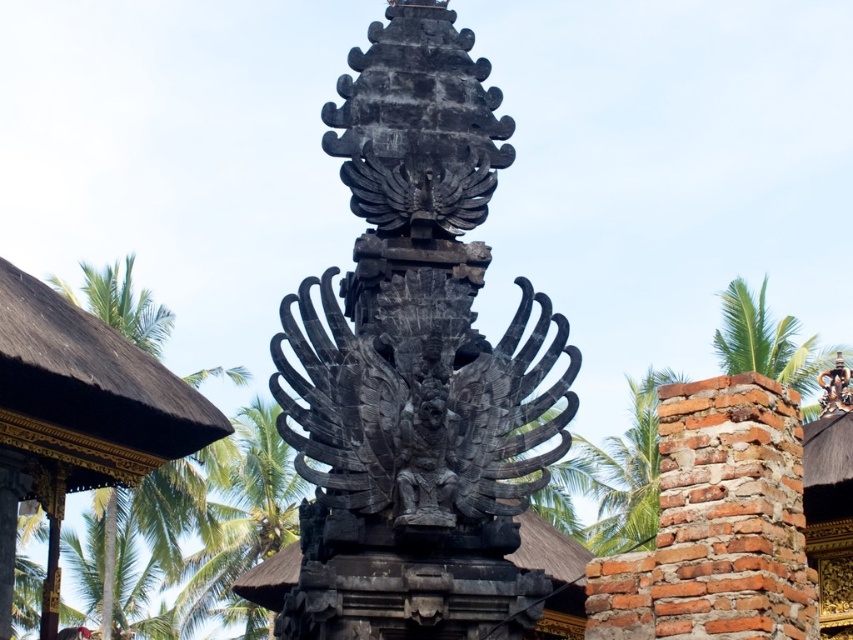
Question: Which object is positioned farthest from the green leafy palm tree at upper right?

Choices:
 (A) golden textured roof at left
 (B) green leafy palm tree at right
 (C) black stone statue at center

Answer: (C)

Question: Can you confirm if green leafy palm tree at right is bigger than green leafy palm tree at upper right?

Choices:
 (A) no
 (B) yes

Answer: (B)

Question: Is golden textured roof at left in front of green leafy palm tree at right?

Choices:
 (A) yes
 (B) no

Answer: (A)

Question: Estimate the real-world distances between objects in this image. Which object is farther from the golden textured roof at left?

Choices:
 (A) green leafy palm tree at upper right
 (B) green leafy palm tree at right
 (C) black stone statue at center

Answer: (B)

Question: Can you confirm if black stone statue at center is positioned to the left of golden textured roof at left?

Choices:
 (A) no
 (B) yes

Answer: (A)

Question: Which of these objects is positioned farthest from the green leafy palm tree at right?

Choices:
 (A) green leafy palm tree at upper right
 (B) golden textured roof at left

Answer: (B)